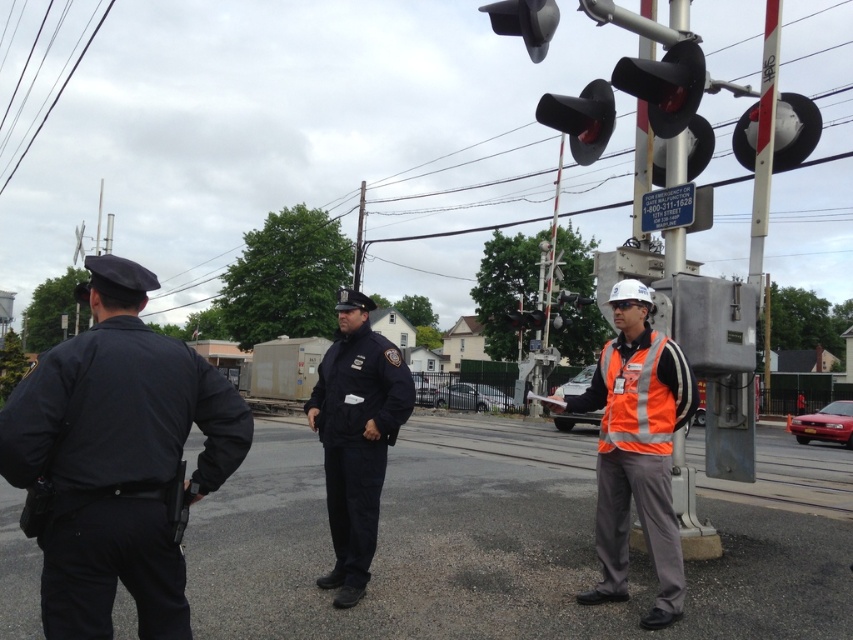
Question: Considering the real-world distances, which object is closest to the red matte traffic light at upper right?

Choices:
 (A) hi-visibility reflective safety vest at right
 (B) white glossy traffic light at upper right

Answer: (A)

Question: Is white glossy traffic light at upper right to the left of black matte traffic light at upper center from the viewer's perspective?

Choices:
 (A) yes
 (B) no

Answer: (B)

Question: Among these points, which one is farthest from the camera?

Choices:
 (A) (637, 76)
 (B) (517, 35)

Answer: (B)

Question: Does hi-visibility reflective safety vest at right have a larger size compared to black rubber traffic light at upper center?

Choices:
 (A) no
 (B) yes

Answer: (A)

Question: Does white glossy traffic light at upper right appear under black matte traffic light at upper center?

Choices:
 (A) no
 (B) yes

Answer: (A)

Question: Which object appears farthest from the camera in this image?

Choices:
 (A) hi-visibility reflective safety vest at right
 (B) dark blue uniform at left

Answer: (A)